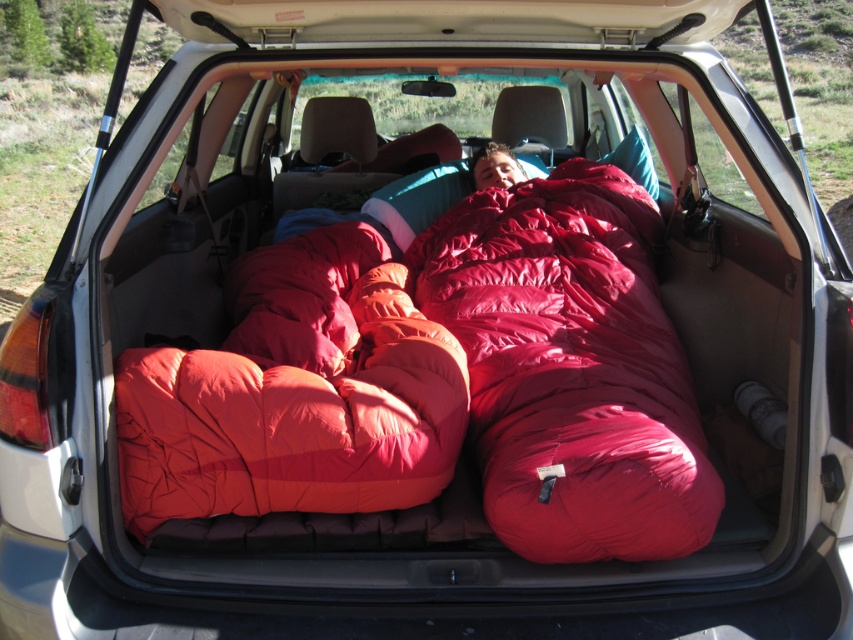
You are standing next to the white SUV and want to place a new item at the exact location of the point marked at coordinates (x=572, y=368). What object would you place there based on the scene description?

You should place the shiny red sleeping bag at center at the coordinates (x=572, y=368) as that is where the point indicates.

In the scene shown: You are standing near the open trunk of the white SUV and want to place a blue pillow between the shiny red sleeping bag at center and the smooth red sleeping bag at center. Can you do this without moving either sleeping bag?

The shiny red sleeping bag at center is closer to the viewer than the smooth red sleeping bag at center, so you can place the blue pillow between them without moving either sleeping bag.

You are packing for a camping trip and need to place the shiny red sleeping bag at center and the matte orange sleeping bag at center into the trunk of your SUV. Based on their positions in the image, which sleeping bag is located higher up?

The shiny red sleeping bag at center is above the matte orange sleeping bag at center, so it is located higher up.